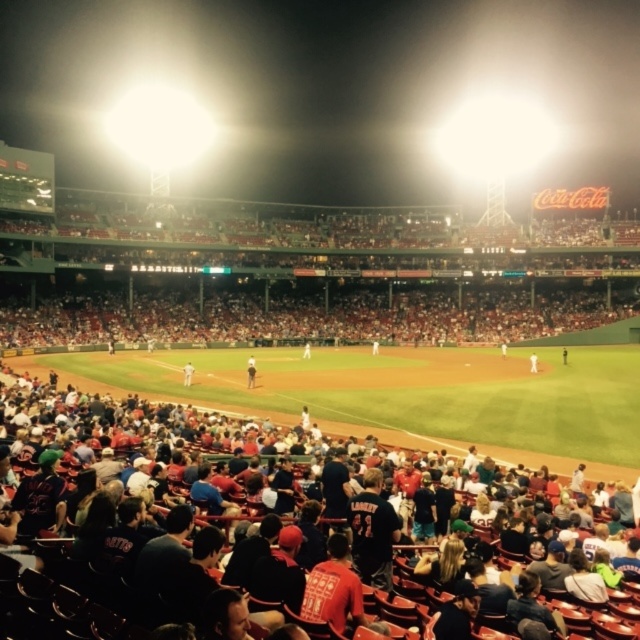
You are a photographer at the baseball game. You want to capture a photo of both the white uniform at center and the dark blue jersey at center. Which player should you focus on first if you want to ensure both are in the frame?

You should focus on the dark blue jersey at center first because the white uniform at center is below it, so adjusting the camera angle to include the lower positioned player would naturally capture the upper one as well.

You are a drone operator trying to capture a closeup shot of the white uniformed player at center. The stadium has a camera mounted at the top of the right field wall. What direction should you move the camera to focus on the player?

The white uniformed player at center is located at coordinates point (188,372). Since the camera is mounted on the right field wall, moving it to the left would align it with the player.

Looking at this image, you are a photographer trying to capture a closeup of the light brown leather baseball glove at center and the white uniformed player at center. Since you want both objects to appear clearly in the photo, which one should you focus on first to ensure proper depth of field?

The light brown leather baseball glove at center is taller than the white uniformed player at center, so you should focus on the light brown leather baseball glove at center first to ensure both are in focus.